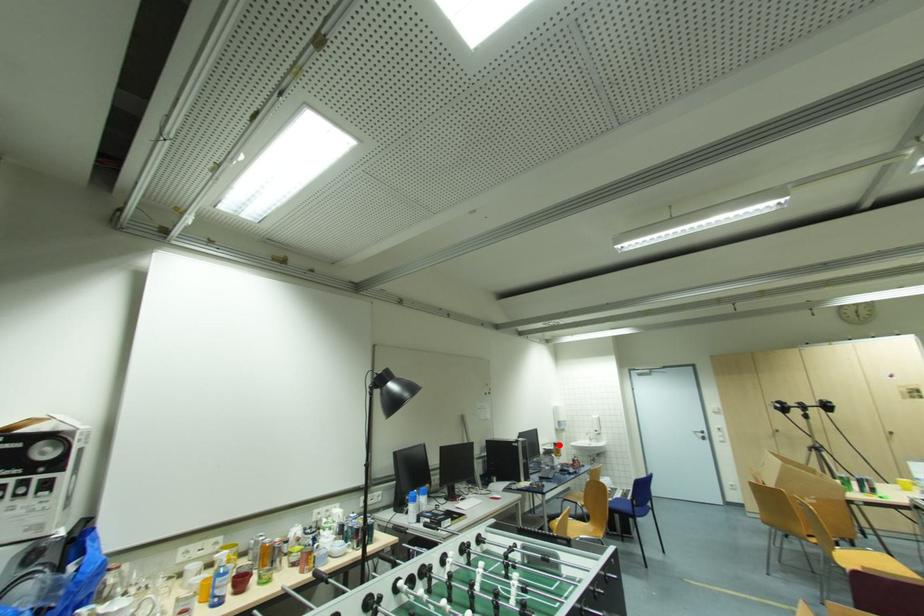
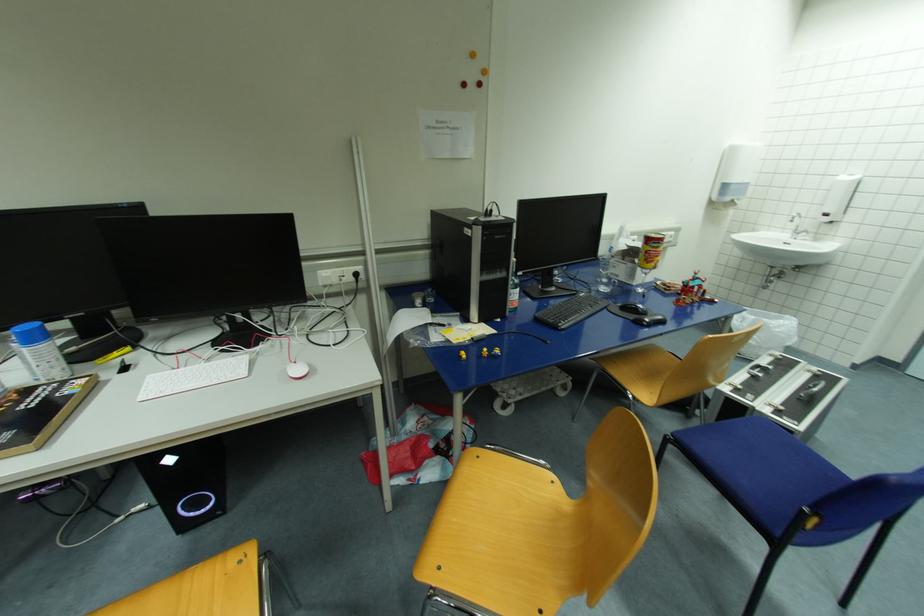
Question: I am providing you with two images of the same scene from different viewpoints. Image1 has a red point marked. In image2, the corresponding 3D location appears at what relative position? Reply with the corresponding letter.

Choices:
 (A) Closer
 (B) Farther

Answer: (A)